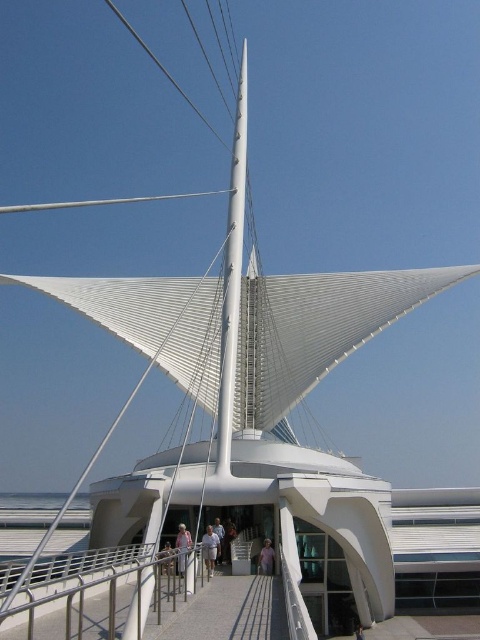
Question: Can you confirm if satin silver railing at lower center is wider than white matte person at center?

Choices:
 (A) yes
 (B) no

Answer: (A)

Question: Considering the real-world distances, which object is farthest from the white matte person at center?

Choices:
 (A) light brown wooden handrail at center
 (B) white fabric at center

Answer: (A)

Question: Which point is closer to the camera?

Choices:
 (A) (210, 540)
 (B) (167, 588)

Answer: (B)

Question: Does gray concrete path at center have a larger size compared to white fabric at center?

Choices:
 (A) no
 (B) yes

Answer: (B)

Question: Is light brown wooden handrail at center wider than light skin tone person at center?

Choices:
 (A) yes
 (B) no

Answer: (B)

Question: Based on their relative distances, which object is farther from the white matte person at center?

Choices:
 (A) satin silver railing at lower center
 (B) white fabric at center
 (C) gray concrete path at center
 (D) light skin tone person at center

Answer: (A)